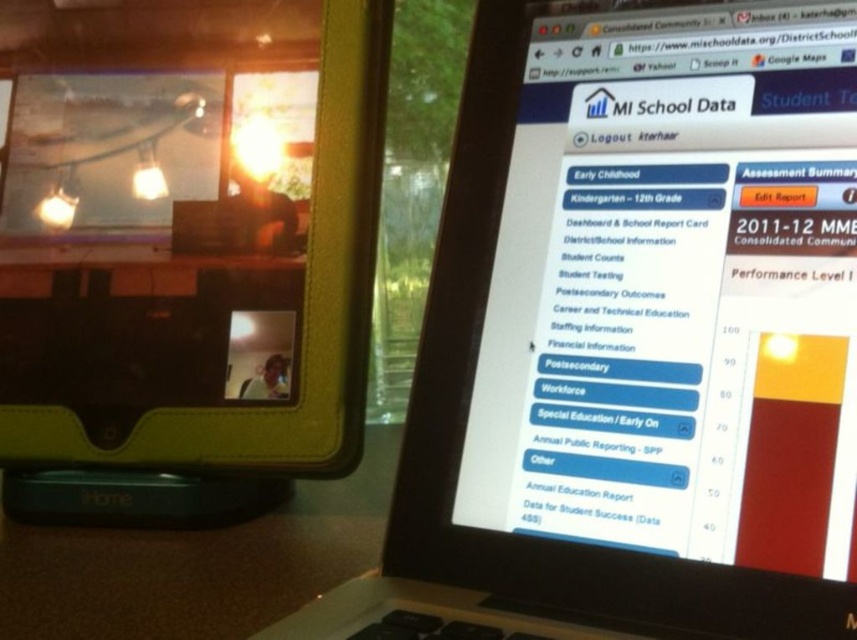
From the picture: You are setting up a shelf to display both the black matte laptop at upper right and the matte black tablet at upper left. The shelf has a width of 30 cm. Can both items fit side by side without overlapping?

The black matte laptop at upper right might be wider than the matte black tablet at upper left. Since their combined widths could exceed 30 cm, it is uncertain if they can fit side by side without overlapping. Check their exact dimensions for confirmation.

You are organizing a virtual meeting and need to check both the black matte laptop at upper right and the matte black tablet at upper left. Which device is positioned lower in the frame?

The black matte laptop at upper right is positioned below the matte black tablet at upper left, so it is lower in the frame.

You are organizing a tech fair and need to place both the black matte laptop at upper right and the matte black tablet at upper left on a display table. The table has a maximum width of 1.2 meters. Given their sizes, can both devices fit side by side on the table without overlapping?

The black matte laptop at upper right is larger in size than the matte black tablet at upper left. Since the combined width of both devices must be less than or equal to 1.2 meters to fit side by side, but without knowing their exact dimensions, it is impossible to determine if they will fit. Additional information about their individual sizes is required to confirm.